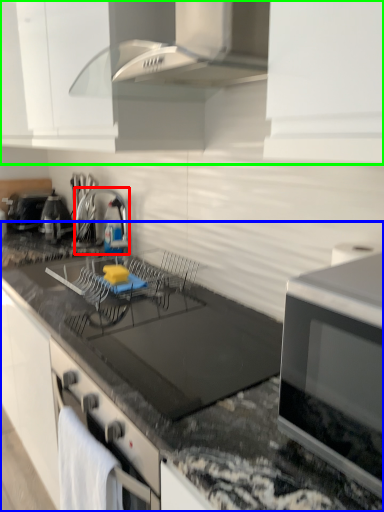
Question: Considering the real-world distances, which object is farthest from appliance (highlighted by a red box)? countertop (highlighted by a blue box) or cabinetry (highlighted by a green box)?

Choices:
 (A) countertop
 (B) cabinetry

Answer: (A)